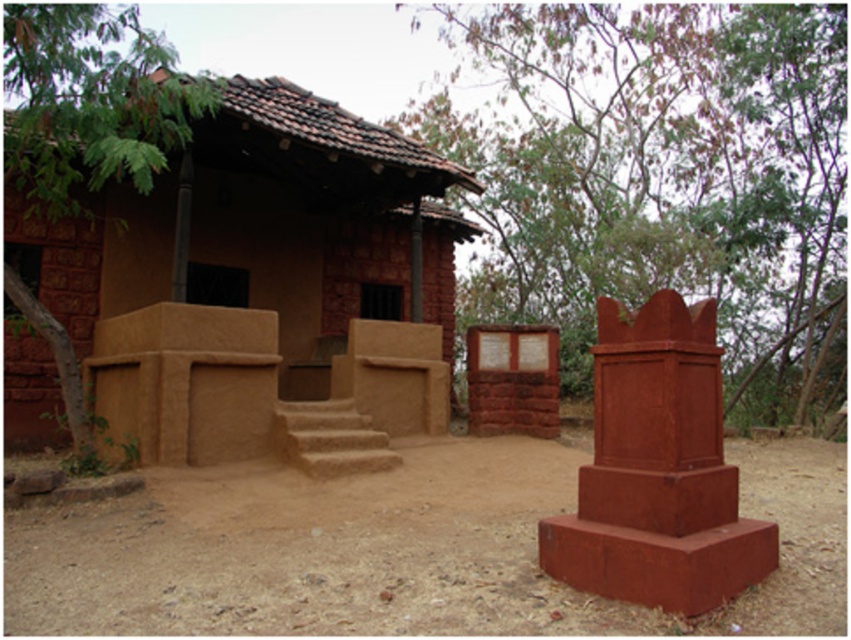
Question: Which point appears farthest from the camera in this image?

Choices:
 (A) (686, 483)
 (B) (574, 115)

Answer: (B)

Question: Which is farther from the matte red stone monument at right?

Choices:
 (A) green leafy tree at upper left
 (B) green leafy tree at upper right
 (C) brown dirt field at center
 (D) brown clay hut at center

Answer: (B)

Question: Considering the real-world distances, which object is closest to the matte red stone monument at right?

Choices:
 (A) brown dirt field at center
 (B) brown clay hut at center
 (C) green leafy tree at upper right
 (D) green leafy tree at upper left

Answer: (A)

Question: Can you confirm if brown clay hut at center is positioned below matte red stone monument at right?

Choices:
 (A) no
 (B) yes

Answer: (A)

Question: Is green leafy tree at upper right below green leafy tree at upper left?

Choices:
 (A) yes
 (B) no

Answer: (B)

Question: Does green leafy tree at upper right appear on the right side of green leafy tree at upper left?

Choices:
 (A) yes
 (B) no

Answer: (A)